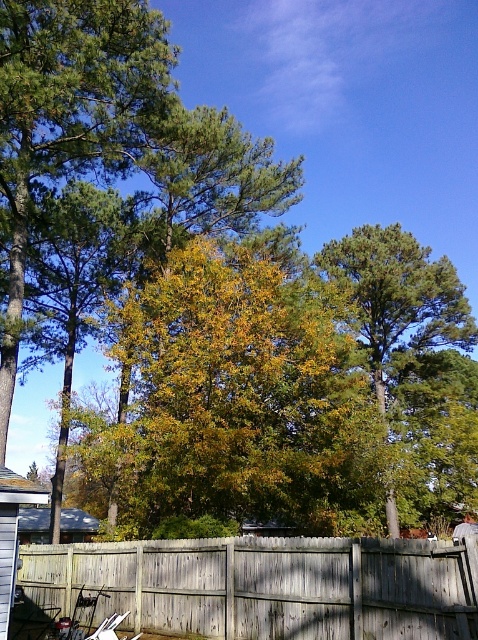
You are standing in the outdoor scene and want to take a photo of the green leafy tree at center. However, the weathered wood fence at center is blocking your view. Can you move to the left or right to avoid the fence?

The weathered wood fence at center is in front of the green leafy tree at center, so moving to the left or right might provide a clearer view of the green leafy tree at center without the fence obstructing it.

From the picture: You are standing at the point marked by the coordinate point at point (268, 586). What object are you standing on?

The point at (268, 586) indicates the weathered wood fence at center, so you are standing on the weathered wood fence at center.